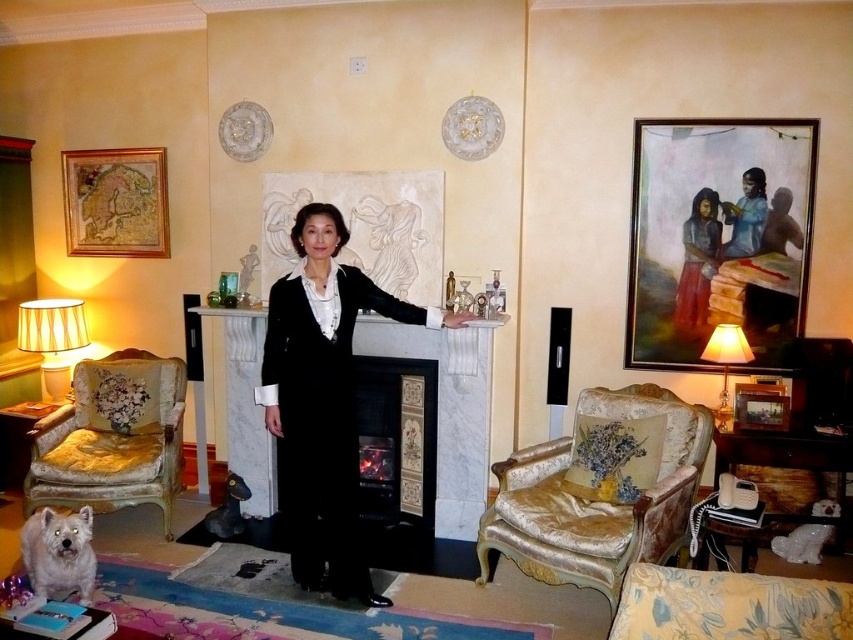
Does point (595, 403) come behind point (364, 484)?

No.

From the picture: Does silky gold armchair at lower right appear on the left side of black tiled fireplace at center?

No, silky gold armchair at lower right is not to the left of black tiled fireplace at center.

Which is behind, point (624, 413) or point (387, 529)?

Point (387, 529)

You are a GUI agent. You are given a task and a screenshot of the screen. Output one action in this format:
    pyautogui.click(x=<x>, y=<y>)
    Task: Click on the silky gold armchair at lower right
    
    Given the screenshot: What is the action you would take?
    pyautogui.click(x=596, y=500)

Does silky gold armchair at lower right appear on the left side of matte red dress at upper right?

Correct, you'll find silky gold armchair at lower right to the left of matte red dress at upper right.

Is point (553, 532) closer to camera compared to point (709, 205)?

Yes, point (553, 532) is closer to viewer.

Between point (508, 486) and point (704, 196), which one is positioned in front?

Positioned in front is point (508, 486).

This screenshot has width=853, height=640. What are the coordinates of `silky gold armchair at lower right` in the screenshot? It's located at (596, 500).

Is point (57, 524) positioned in front of point (688, 252)?

Yes, it is.

Who is more forward, (68, 556) or (706, 301)?

Point (68, 556) is in front.

This screenshot has height=640, width=853. Find the location of `white fluffy dog at lower left`. white fluffy dog at lower left is located at coordinates (59, 554).